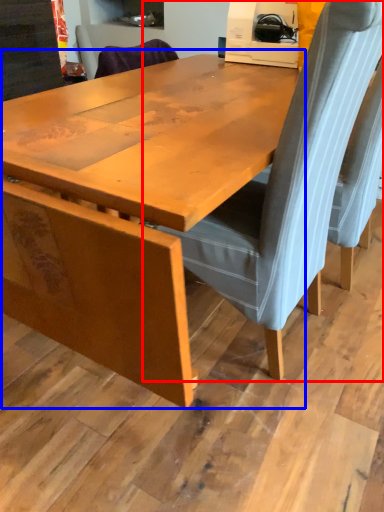
Question: Which object appears farthest to the camera in this image, chair (highlighted by a red box) or table (highlighted by a blue box)?

Choices:
 (A) chair
 (B) table

Answer: (A)